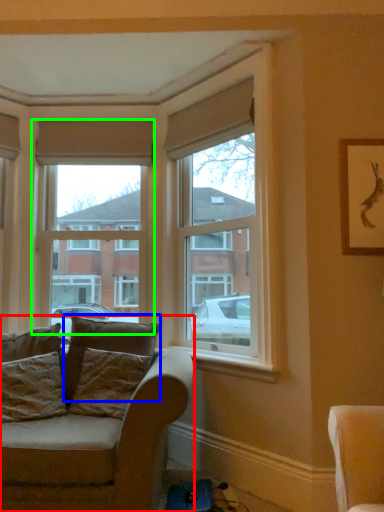
Question: Which object is the farthest from studio couch (highlighted by a red box)? Choose among these: pillow (highlighted by a blue box) or window (highlighted by a green box).

Choices:
 (A) pillow
 (B) window

Answer: (B)